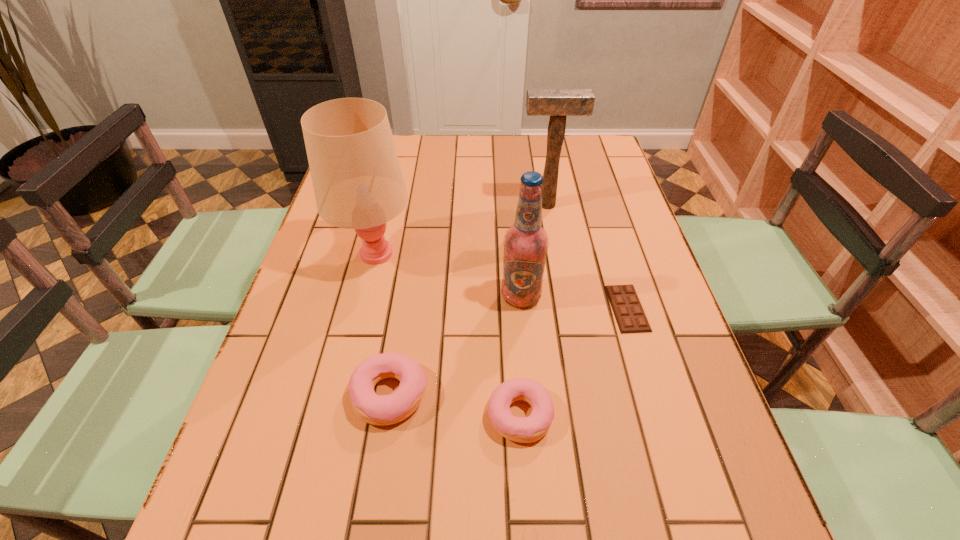
In order to click on the taller doughnut in this screenshot , I will do `click(381, 410)`.

Find the location of a particular element. the third shortest object is located at coordinates (381, 410).

Locate an element on the screen. Image resolution: width=960 pixels, height=540 pixels. the right doughnut is located at coordinates (529, 429).

Find the location of a particular element. This screenshot has height=540, width=960. the shorter doughnut is located at coordinates (529, 429).

What are the coordinates of `lampshade` in the screenshot? It's located at (358, 184).

This screenshot has height=540, width=960. Identify the location of the shortest object. (629, 314).

The image size is (960, 540). Find the location of `the rightmost object`. the rightmost object is located at coordinates (629, 314).

Where is `mallet`? The width and height of the screenshot is (960, 540). mallet is located at coordinates (557, 103).

At what (x,y) coordinates should I click in order to perform the action: click on alcohol. Please return your answer as a coordinate pair (x, y). This screenshot has width=960, height=540. Looking at the image, I should click on (526, 242).

The image size is (960, 540). I want to click on vacant region located 0.220m on the right of the taller doughnut, so click(x=539, y=394).